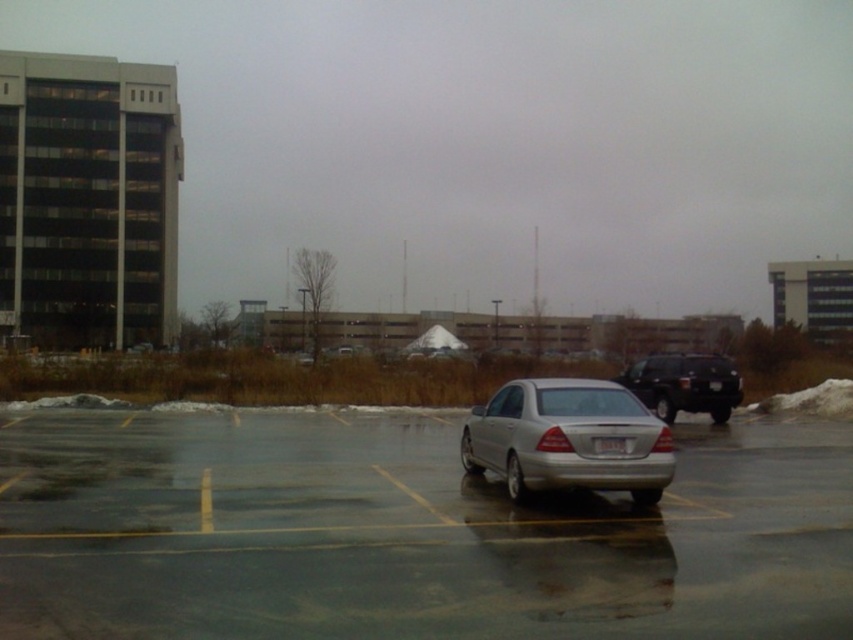
You are a delivery person trying to park your van in the parking lot. You see the silver metallic car at center and the white plastic license plate at center. Which object is larger in size?

The silver metallic car at center is bigger than the white plastic license plate at center.

You are standing at the center of the parking lot and want to locate the shiny black suv at right. According to the coordinate system where the bottom left corner is the origin, can you determine its position?

The shiny black suv at right is located at point (x=683, y=385), so it is positioned at 60.2 percent along the x axis and 80.3 percent along the y axis from the bottom left corner of the parking lot.